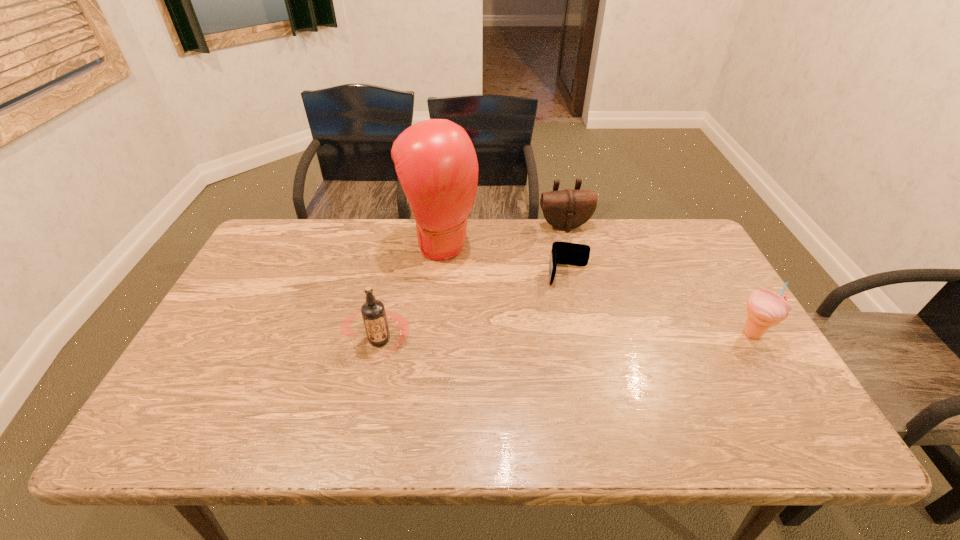
Locate an element on the screen. vacant space in between the root beer and the icecream is located at coordinates (565, 336).

This screenshot has width=960, height=540. I want to click on vacant space that's between the tallest object and the pouch, so click(503, 234).

Locate an element on the screen. free spot between the shortest object and the boxing glove is located at coordinates (505, 259).

Identify the location of unoccupied area between the tallest object and the wallet. (505, 259).

You are a GUI agent. You are given a task and a screenshot of the screen. Output one action in this format:
    pyautogui.click(x=<x>, y=<y>)
    Task: Click on the object that is the closest to the boxing glove
    This screenshot has height=540, width=960.
    Given the screenshot: What is the action you would take?
    pyautogui.click(x=373, y=312)

Locate an element on the screen. The image size is (960, 540). object identified as the fourth closest to the tallest object is located at coordinates (765, 308).